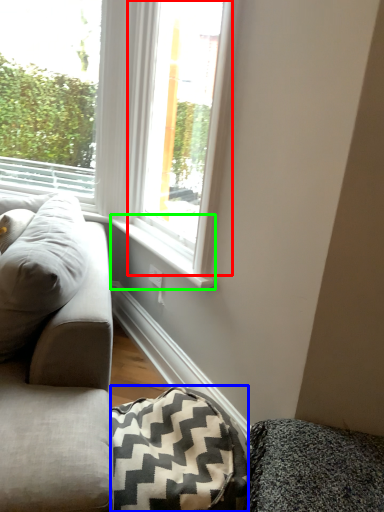
Question: Which is farther away from window (highlighted by a red box)? blanket (highlighted by a blue box) or window sill (highlighted by a green box)?

Choices:
 (A) blanket
 (B) window sill

Answer: (A)